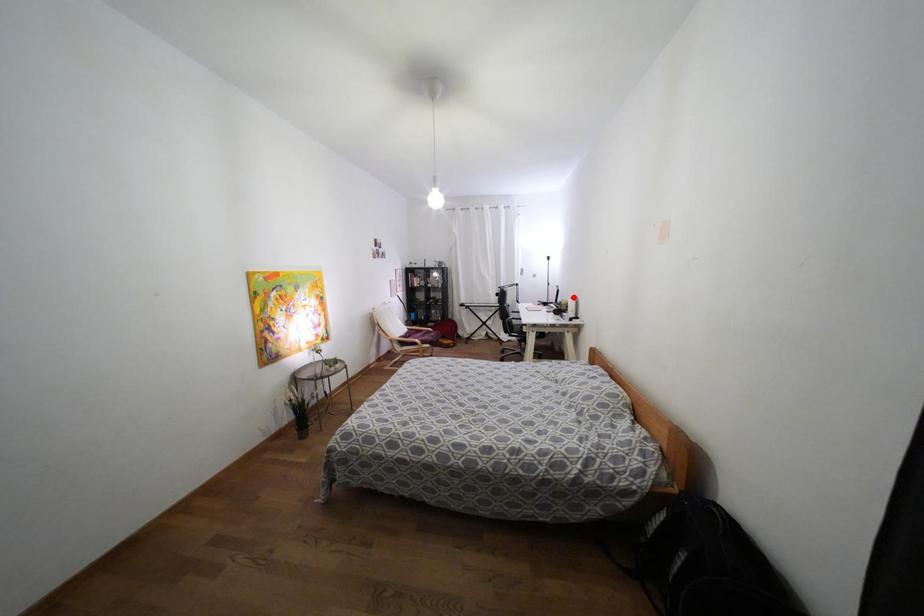
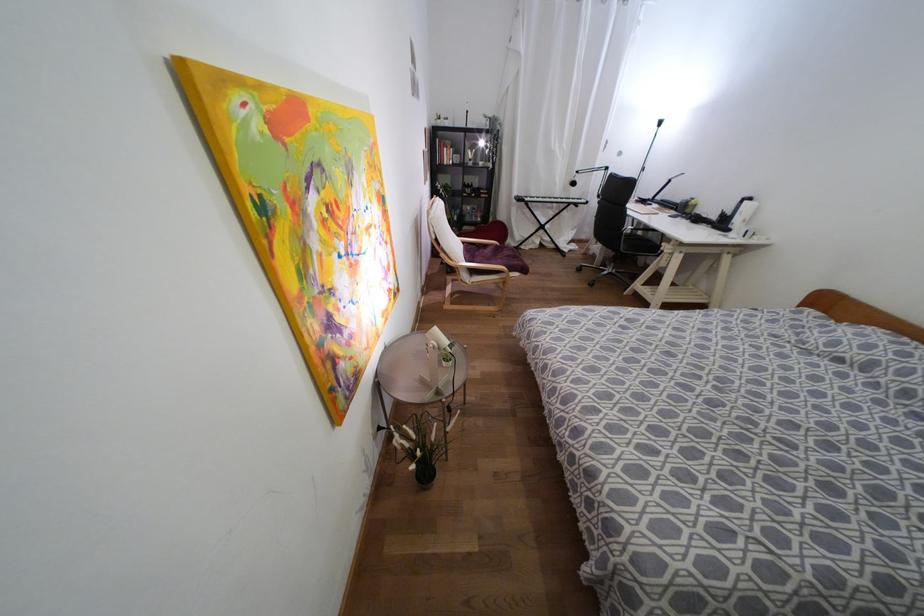
Locate, in the second image, the point that corresponds to the highlighted location in the first image.

(749, 198)